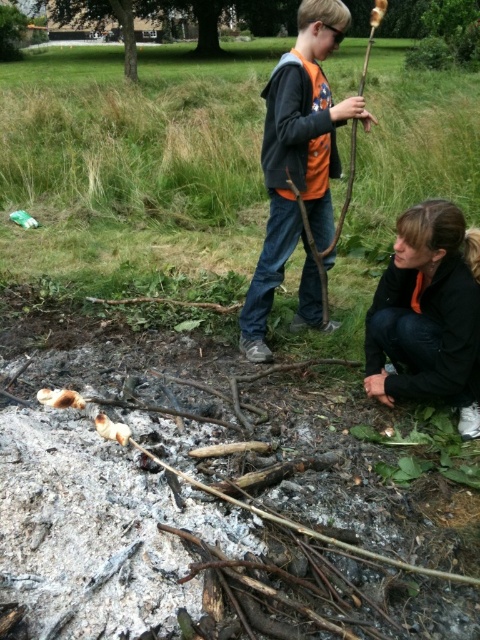
Question: Which point is farther to the camera?

Choices:
 (A) black soft jacket at lower right
 (B) orange fabric shirt at center

Answer: (B)

Question: Which of the following is the farthest from the observer?

Choices:
 (A) black soft jacket at lower right
 (B) orange fabric shirt at center

Answer: (B)

Question: Is orange fabric shirt at center above black soft jacket at lower right?

Choices:
 (A) yes
 (B) no

Answer: (A)

Question: Which object appears farthest from the camera in this image?

Choices:
 (A) orange fabric shirt at center
 (B) black soft jacket at lower right

Answer: (A)

Question: Does orange fabric shirt at center come in front of black soft jacket at lower right?

Choices:
 (A) yes
 (B) no

Answer: (B)

Question: Does orange fabric shirt at center have a greater width compared to black soft jacket at lower right?

Choices:
 (A) no
 (B) yes

Answer: (B)